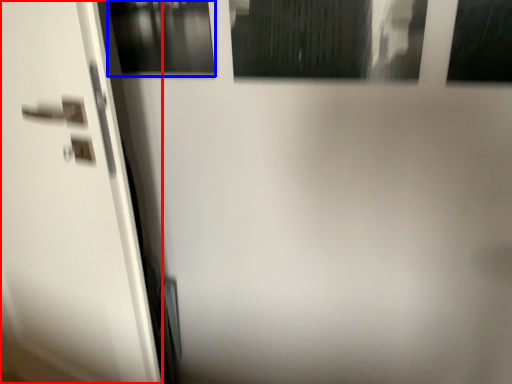
Question: Among these objects, which one is nearest to the camera, screen door (highlighted by a red box) or window (highlighted by a blue box)?

Choices:
 (A) screen door
 (B) window

Answer: (A)